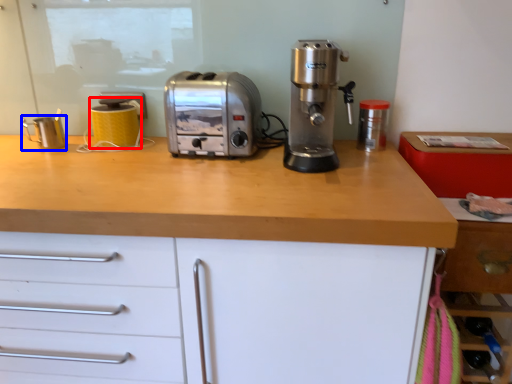
Question: Which object is further to the camera taking this photo, kitchen appliance (highlighted by a red box) or kitchen appliance (highlighted by a blue box)?

Choices:
 (A) kitchen appliance
 (B) kitchen appliance

Answer: (A)